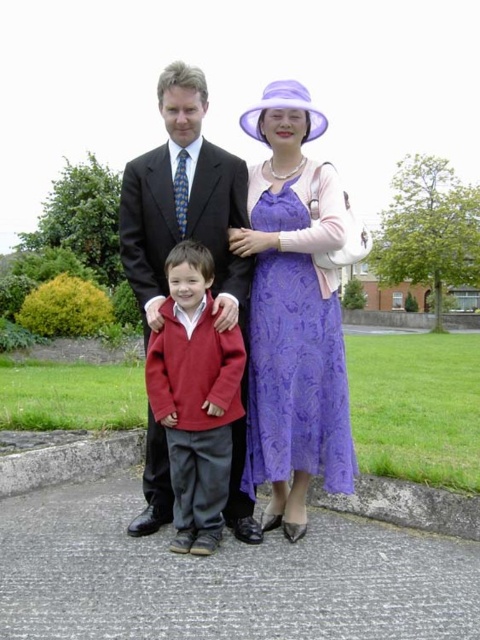
You are a photographer setting up for a family portrait. You have two subjects wearing the matte black suit at center and the matte red sweater at center. Based on their clothing sizes, which subject should you position closer to the camera to maintain proportional balance in the photo?

The matte black suit at center is larger in size than the matte red sweater at center. To maintain proportional balance, position the person wearing the matte red sweater at center closer to the camera so they appear larger in the frame, balancing their size with the person in the matte black suit at center.

You are a photographer setting up for a family portrait. You notice the purple lace dress at center and the matte black suit at center. Based on their positions, which clothing item is closer to the right side of the image?

The purple lace dress at center is to the right of the matte black suit at center, so the purple lace dress at center is closer to the right side of the image.

Based on the scene description, what object is located at the coordinates point (183, 204)?

The object at point (183, 204) is the matte black suit at center.